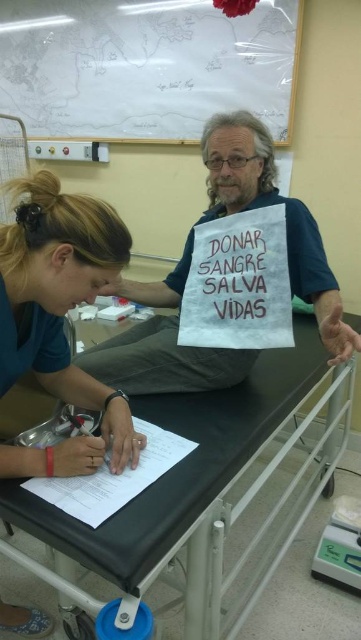
In the scene shown: You are a nurse in the clinic and need to locate the blood donation sign. You see the matte blue shirt at lower left and the blue fabric sign at center. Which object is closer to you?

The matte blue shirt at lower left is closer to the viewer than the blue fabric sign at center.

You are a nurse in a clinic. You need to place a new poster on the wall at a specific point. The poster is 30 inches wide. Can you fit it horizontally at the point labeled point (41,264) without overlapping anything? The wall space there is 36.69 inches from the camera to that point.

The distance from the camera to point (41,264) is 36.69 inches. Since the poster is 30 inches wide, it can fit horizontally at that point as the available space is wider than the poster.

You are a nurse in a clinic. You need to locate the point at coordinates (59, 320) on the patient. Where exactly is this point located on the patient?

The point at coordinates (59, 320) is on the matte blue shirt at lower left of the patient.